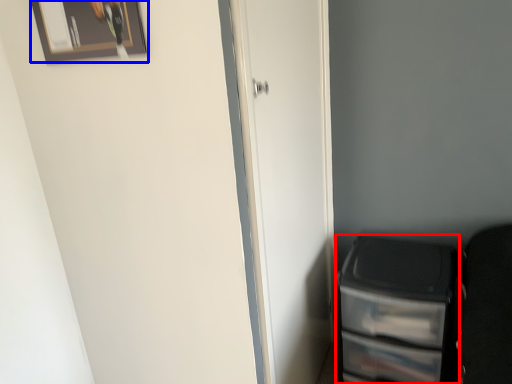
Question: Which point is further to the camera, file cabinet (highlighted by a red box) or picture frame (highlighted by a blue box)?

Choices:
 (A) file cabinet
 (B) picture frame

Answer: (A)